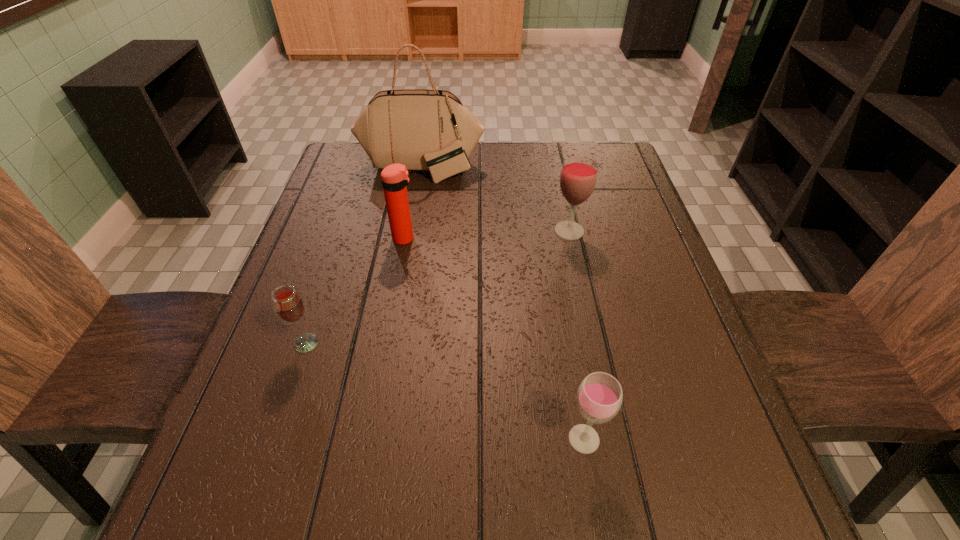
Find the location of a particular element. the farthest object is located at coordinates (422, 129).

Find the location of a particular element. the tallest object is located at coordinates (422, 129).

You are a GUI agent. You are given a task and a screenshot of the screen. Output one action in this format:
    pyautogui.click(x=<x>, y=<y>)
    Task: Click on the thermos bottle
    The image size is (960, 540).
    Given the screenshot: What is the action you would take?
    pyautogui.click(x=394, y=177)

At what (x,y) coordinates should I click in order to perform the action: click on the farthest wineglass. Please return your answer as a coordinate pair (x, y). The width and height of the screenshot is (960, 540). Looking at the image, I should click on (579, 176).

Image resolution: width=960 pixels, height=540 pixels. I want to click on the nearest wineglass, so click(x=599, y=397).

The image size is (960, 540). In order to click on the second nearest object in this screenshot , I will do `click(289, 306)`.

Identify the location of the leftmost wineglass. (289, 306).

The height and width of the screenshot is (540, 960). Find the location of `free space located on the side of the tallest object with the attached pouch`. free space located on the side of the tallest object with the attached pouch is located at coordinates (410, 237).

Locate an element on the screen. This screenshot has height=540, width=960. vacant space located on the right of the thermos bottle is located at coordinates (461, 239).

Find the location of `blank space located 0.230m on the left of the farthest wineglass`. blank space located 0.230m on the left of the farthest wineglass is located at coordinates (462, 231).